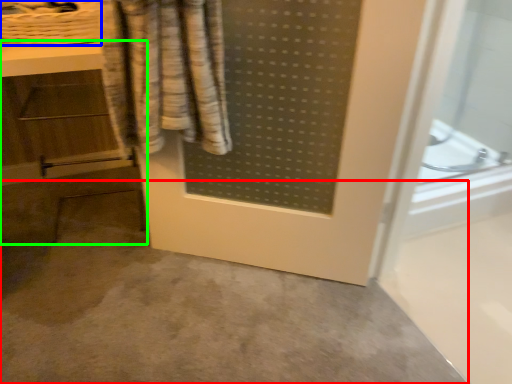
Question: Which object is positioned closest to concrete (highlighted by a red box)? Select from basket (highlighted by a blue box) and vanity (highlighted by a green box).

Choices:
 (A) basket
 (B) vanity

Answer: (B)